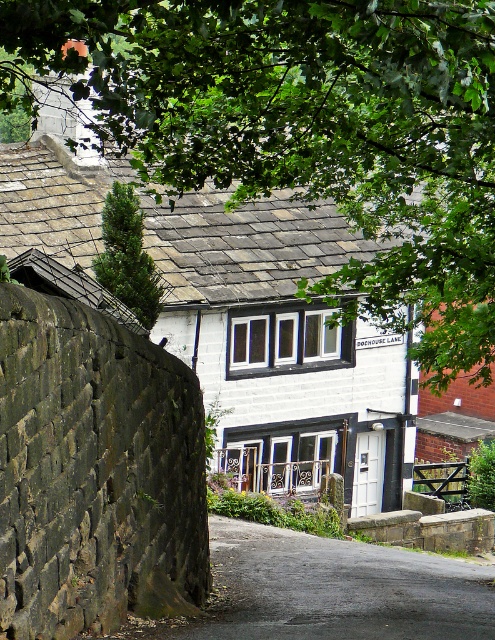
Does green leafy tree at upper center have a larger size compared to green coniferous tree at upper left?

Yes.

Between point (372, 198) and point (132, 301), which one is positioned in front?

Positioned in front is point (372, 198).

Identify the location of green leafy tree at upper center. The image size is (495, 640). click(x=305, y=129).

What are the coordinates of `green leafy tree at upper center` in the screenshot? It's located at (305, 129).